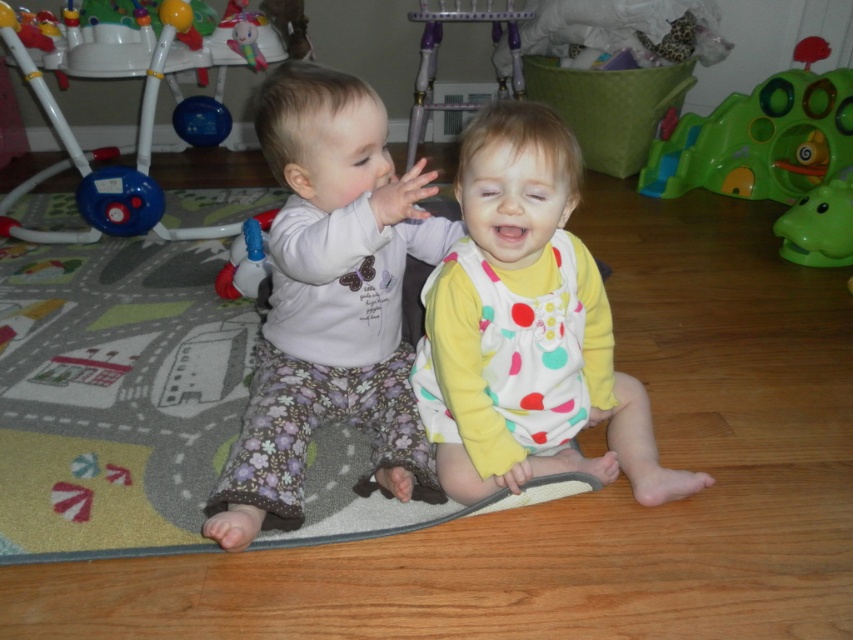
Question: Which point is closer to the camera?

Choices:
 (A) (250, 250)
 (B) (808, 109)
 (C) (9, 8)

Answer: (A)

Question: From the image, what is the correct spatial relationship of polka dot fabric dress at center in relation to white plastic walker at left?

Choices:
 (A) above
 (B) below

Answer: (B)

Question: Among these objects, which one is farthest from the camera?

Choices:
 (A) polka dot fabric dress at center
 (B) white plastic walker at left

Answer: (B)

Question: Among these objects, which one is nearest to the camera?

Choices:
 (A) polka dot fabric dress at center
 (B) floral cotton pants at center

Answer: (B)

Question: Is white plastic walker at left above transparent plastic spray bottle at left?

Choices:
 (A) yes
 (B) no

Answer: (A)

Question: Is polka dot fabric dress at center wider than white plastic walker at left?

Choices:
 (A) no
 (B) yes

Answer: (A)